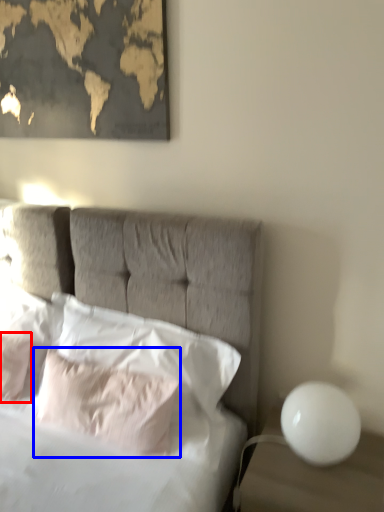
Question: Which point is closer to the camera, pillow (highlighted by a red box) or pillow (highlighted by a blue box)?

Choices:
 (A) pillow
 (B) pillow

Answer: (B)